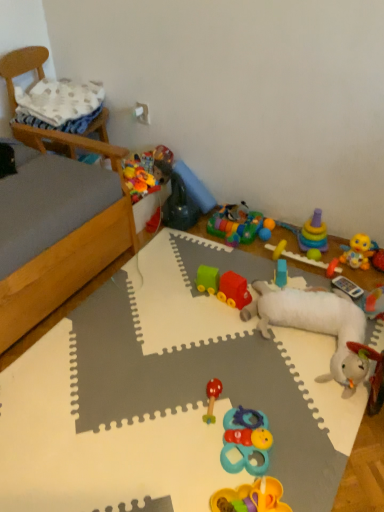
Where is `vacant space that is in between white plush sheep at center, the third toy ordered from the bottom, and blue plastic toy at center, which is counted as the sixth toy, starting from the top`? The width and height of the screenshot is (384, 512). vacant space that is in between white plush sheep at center, the third toy ordered from the bottom, and blue plastic toy at center, which is counted as the sixth toy, starting from the top is located at coordinates (307, 280).